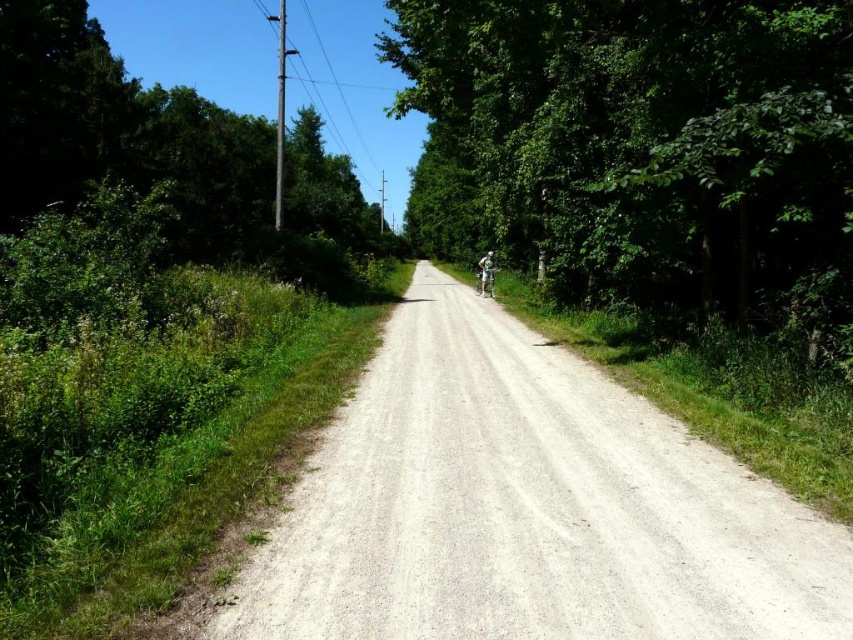
Based on the photo, is gray gravel road at center taller than metallic silver bicycle at center?

Yes, gray gravel road at center is taller than metallic silver bicycle at center.

Which is more to the left, gray gravel road at center or metallic silver bicycle at center?

gray gravel road at center is more to the left.

Between point (624, 525) and point (488, 269), which one is positioned in front?

Positioned in front is point (624, 525).

Identify the location of gray gravel road at center. Image resolution: width=853 pixels, height=640 pixels. (527, 508).

Is gray gravel road at center to the right of green leafy tree at left from the viewer's perspective?

Indeed, gray gravel road at center is positioned on the right side of green leafy tree at left.

Does gray gravel road at center appear under green leafy tree at left?

Yes.

Who is more forward, (811, 524) or (59, 138)?

Positioned in front is point (811, 524).

Locate an element on the screen. The width and height of the screenshot is (853, 640). gray gravel road at center is located at coordinates (527, 508).

Does point (816, 339) lie in front of point (286, 240)?

That is True.

Which is more to the right, green leafy tree at center or green leafy tree at left?

From the viewer's perspective, green leafy tree at center appears more on the right side.

Who is more forward, (482, 125) or (13, 227)?

Point (13, 227) is more forward.

Locate an element on the screen. This screenshot has width=853, height=640. green leafy tree at center is located at coordinates (642, 150).